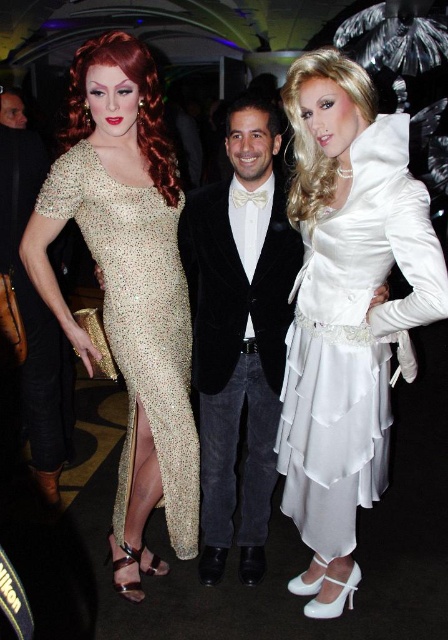
Question: Which of the following is the closest to the observer?

Choices:
 (A) white satin dress at right
 (B) sparkly gold dress at left
 (C) velvet black blazer at center

Answer: (A)

Question: Does white satin dress at right lie behind velvet black blazer at center?

Choices:
 (A) no
 (B) yes

Answer: (A)

Question: Considering the relative positions of velvet black blazer at center and sparkly gold dress at left in the image provided, where is velvet black blazer at center located with respect to sparkly gold dress at left?

Choices:
 (A) left
 (B) right

Answer: (B)

Question: Among these objects, which one is farthest from the camera?

Choices:
 (A) velvet black blazer at center
 (B) white satin dress at right
 (C) sparkly gold dress at left

Answer: (A)

Question: Which of the following is the closest to the observer?

Choices:
 (A) sparkly gold dress at left
 (B) white satin dress at right
 (C) velvet black blazer at center

Answer: (B)

Question: Can you confirm if white satin dress at right is smaller than velvet black blazer at center?

Choices:
 (A) yes
 (B) no

Answer: (A)